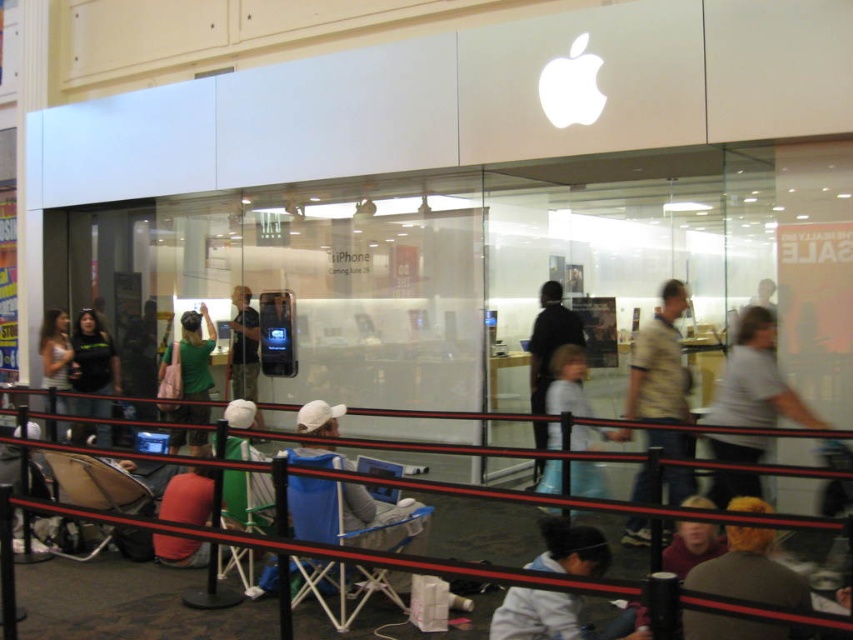
Question: Which point appears farthest from the camera in this image?

Choices:
 (A) (149, 525)
 (B) (231, 304)
 (C) (51, 384)
 (D) (683, 628)

Answer: (B)

Question: Which point is farther to the camera?

Choices:
 (A) (769, 520)
 (B) (538, 632)

Answer: (B)

Question: Which is farther from the brown fabric chair at lower left?

Choices:
 (A) dark blue shirt at center
 (B) green fabric chair at lower center
 (C) metallic red barrier at lower center

Answer: (A)

Question: Does light blue denim jeans at lower center have a greater width compared to brown fabric chair at lower left?

Choices:
 (A) yes
 (B) no

Answer: (B)

Question: Does dark blue shirt at center have a greater width compared to matte green shirt at lower left?

Choices:
 (A) yes
 (B) no

Answer: (B)

Question: Observing the image, what is the correct spatial positioning of white cotton shirt at lower right in reference to green fabric chair at lower center?

Choices:
 (A) above
 (B) below

Answer: (A)